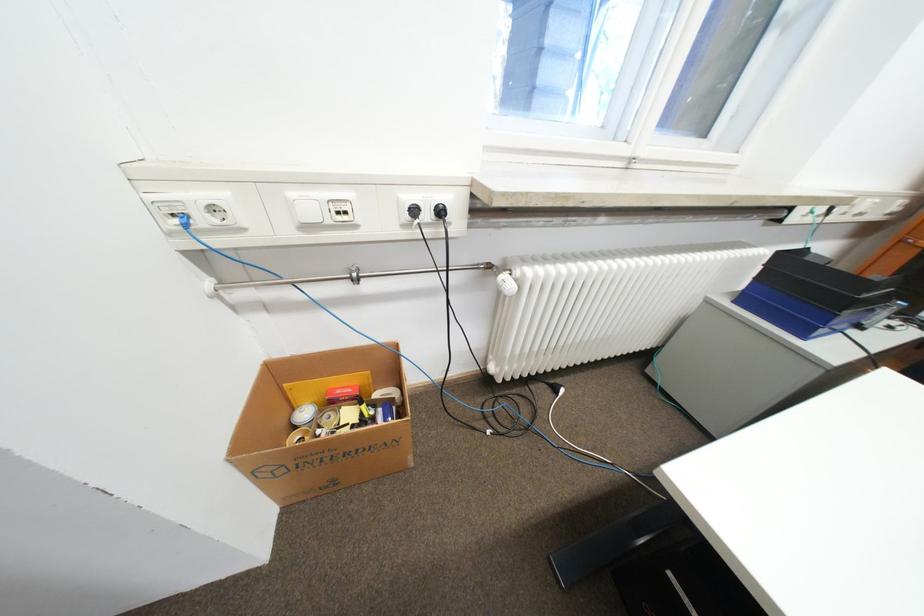
I want to click on black power plug, so click(x=440, y=211).